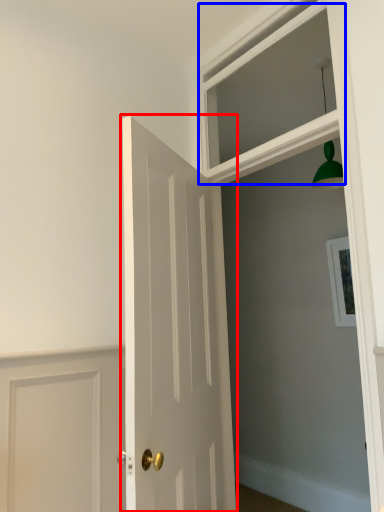
Question: Which of the following is the closest to the observer, door (highlighted by a red box) or window (highlighted by a blue box)?

Choices:
 (A) door
 (B) window

Answer: (A)